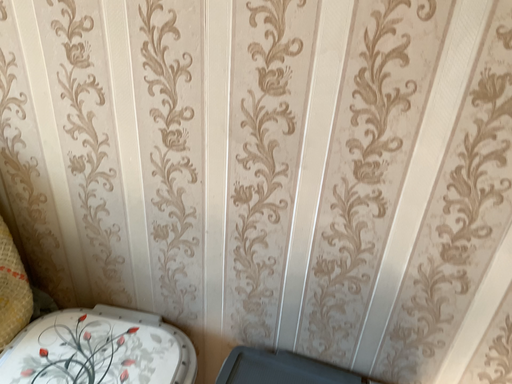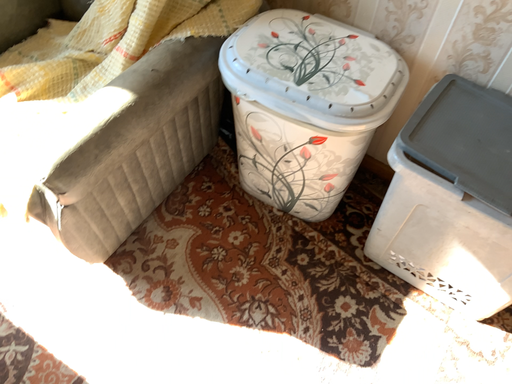
Question: How did the camera likely rotate when shooting the video?

Choices:
 (A) rotated left
 (B) rotated right

Answer: (A)